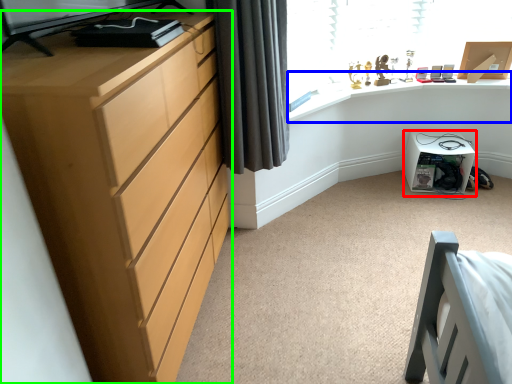
Question: Which object is positioned farthest from cabinetry (highlighted by a red box)? Select from computer desk (highlighted by a blue box) and chest of drawers (highlighted by a green box).

Choices:
 (A) computer desk
 (B) chest of drawers

Answer: (B)